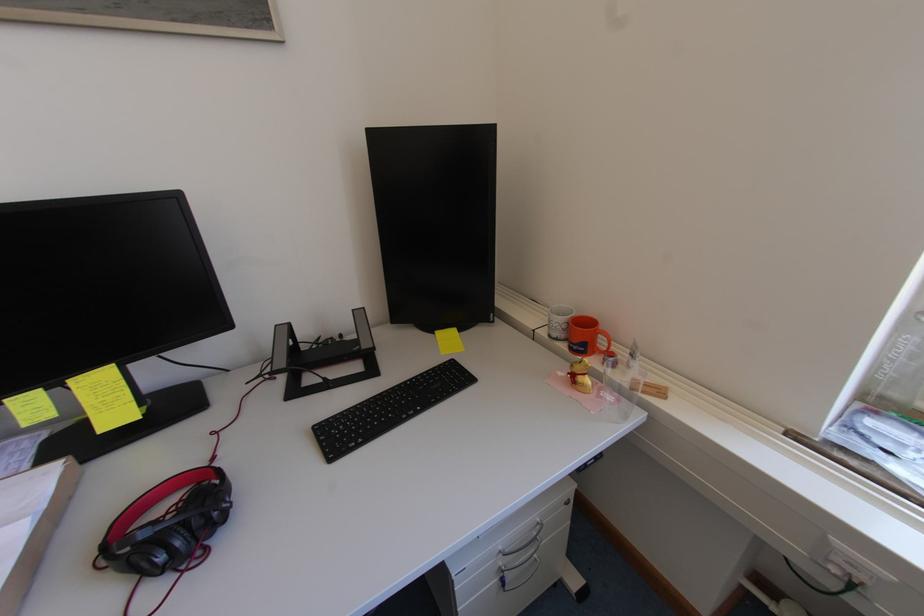
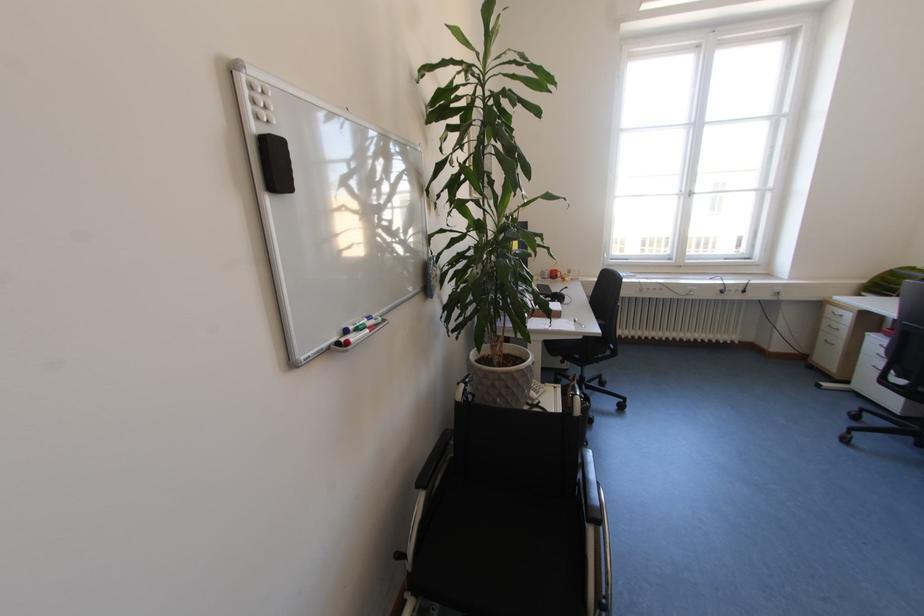
Find the pixel in the second image that matches pixel 562 336 in the first image.

(553, 278)